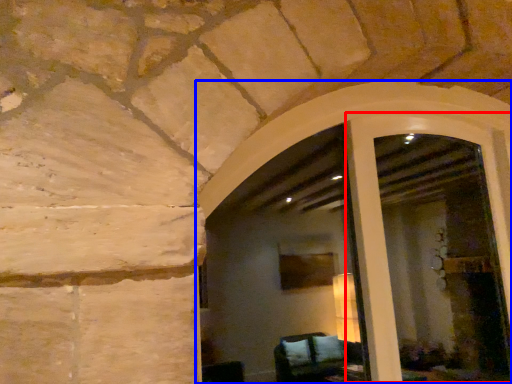
Question: Among these objects, which one is farthest to the camera, screen door (highlighted by a red box) or window frame (highlighted by a blue box)?

Choices:
 (A) screen door
 (B) window frame

Answer: (A)